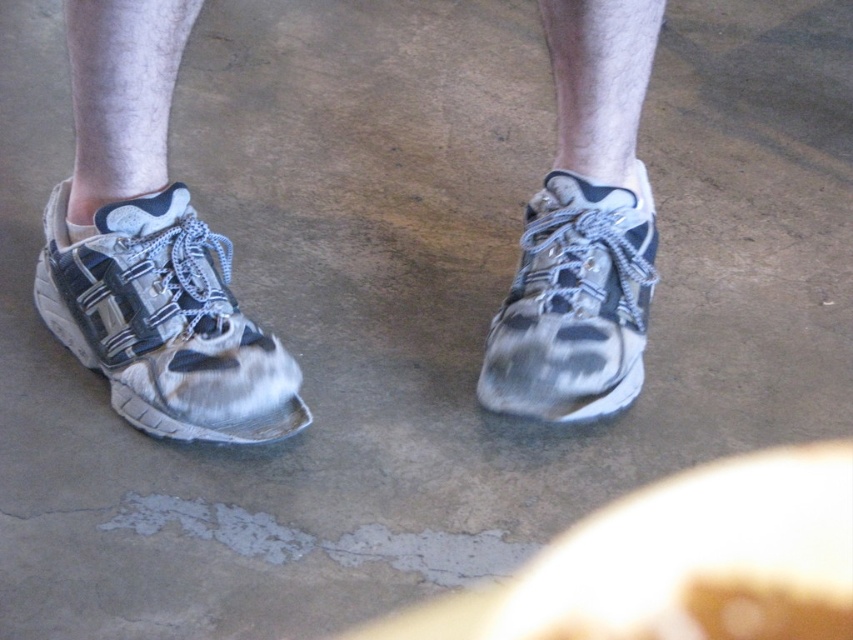
You are a shoe repair technician assessing the damage on both pairs of worn leather sneakers at center and worn leather sneaker at left. Which one has a higher height?

The worn leather sneakers at center is taller than the worn leather sneaker at left, so the one at center has a higher height.

You are a shoe repair specialist who needs to place two pairs of shoes on a 15 inch long repair table. You have the worn leather sneakers at center and the worn leather sneaker at center. Can both pairs fit on the table without overlapping?

The worn leather sneakers at center and worn leather sneaker at center are 15.11 inches apart, so they cannot fit on a 15 inch table without overlapping since the required space is slightly more than the table length.